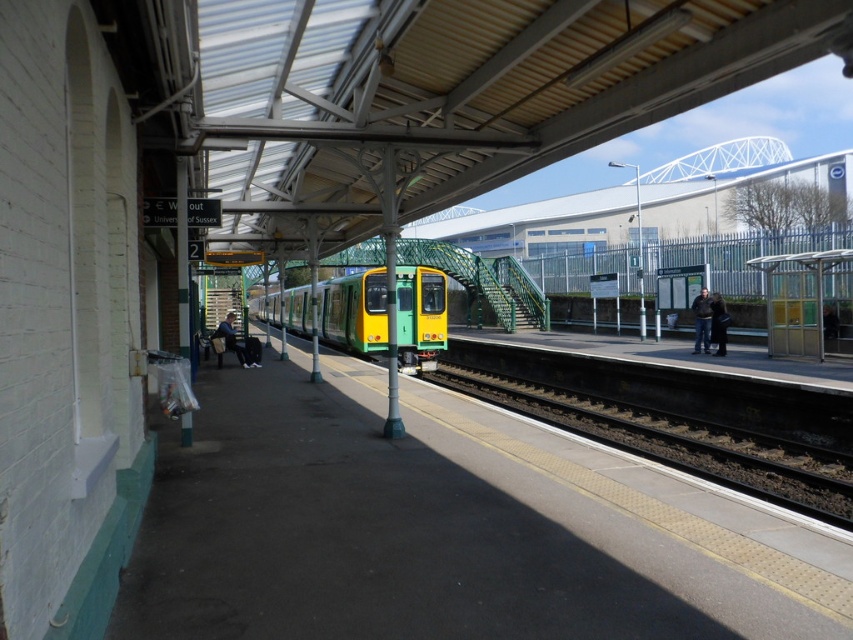
Question: Does black asphalt track at center appear on the left side of denim jacket at left?

Choices:
 (A) no
 (B) yes

Answer: (A)

Question: Which point is farther to the camera?

Choices:
 (A) pyautogui.click(x=717, y=305)
 (B) pyautogui.click(x=550, y=588)

Answer: (A)

Question: Which object is farther from the camera taking this photo?

Choices:
 (A) denim jacket at left
 (B) dark blue jeans at right

Answer: (A)

Question: Can you confirm if black asphalt track at center is positioned below dark blue jeans at right?

Choices:
 (A) yes
 (B) no

Answer: (A)

Question: Which object is positioned farthest from the dark blue jeans at right?

Choices:
 (A) smooth concrete platform at lower left
 (B) dark brown leather jacket at right

Answer: (A)

Question: Can you confirm if green matte train at center is wider than dark brown leather jacket at right?

Choices:
 (A) no
 (B) yes

Answer: (B)